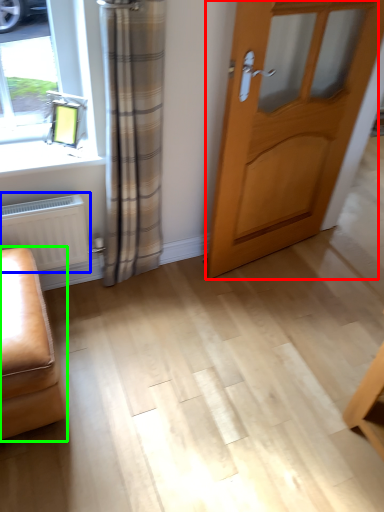
Question: Which object is the farthest from door (highlighted by a red box)? Choose among these: radiator (highlighted by a blue box) or furniture (highlighted by a green box).

Choices:
 (A) radiator
 (B) furniture

Answer: (B)